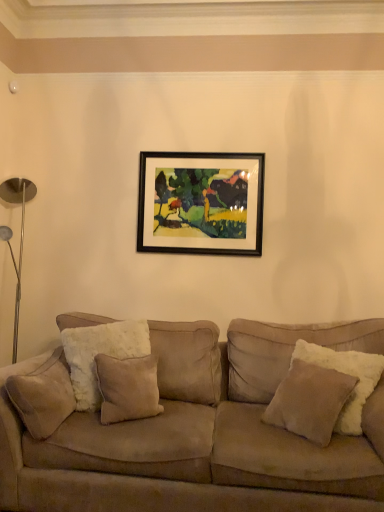
You are a GUI agent. You are given a task and a screenshot of the screen. Output one action in this format:
    pyautogui.click(x=<x>, y=<y>)
    Task: Click on the empty space that is ontop of black framed painting at upper center (from a real-world perspective)
    This screenshot has height=512, width=384.
    Given the screenshot: What is the action you would take?
    pyautogui.click(x=201, y=152)